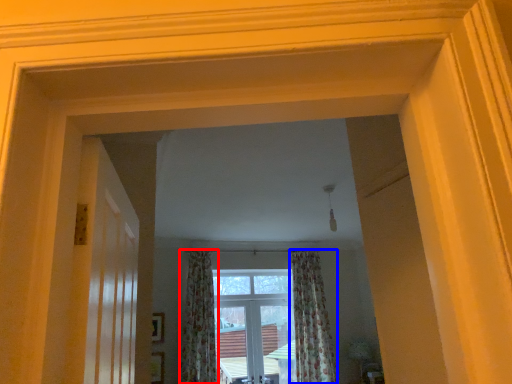
Question: Which point is closer to the camera, curtain (highlighted by a red box) or curtain (highlighted by a blue box)?

Choices:
 (A) curtain
 (B) curtain

Answer: (A)